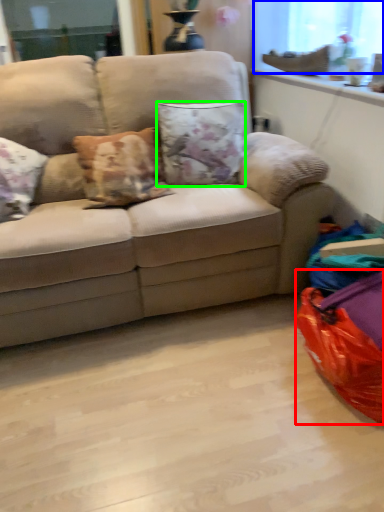
Question: Which object is positioned farthest from bean bag chair (highlighted by a red box)? Select from window screen (highlighted by a blue box) and pillow (highlighted by a green box).

Choices:
 (A) window screen
 (B) pillow

Answer: (A)